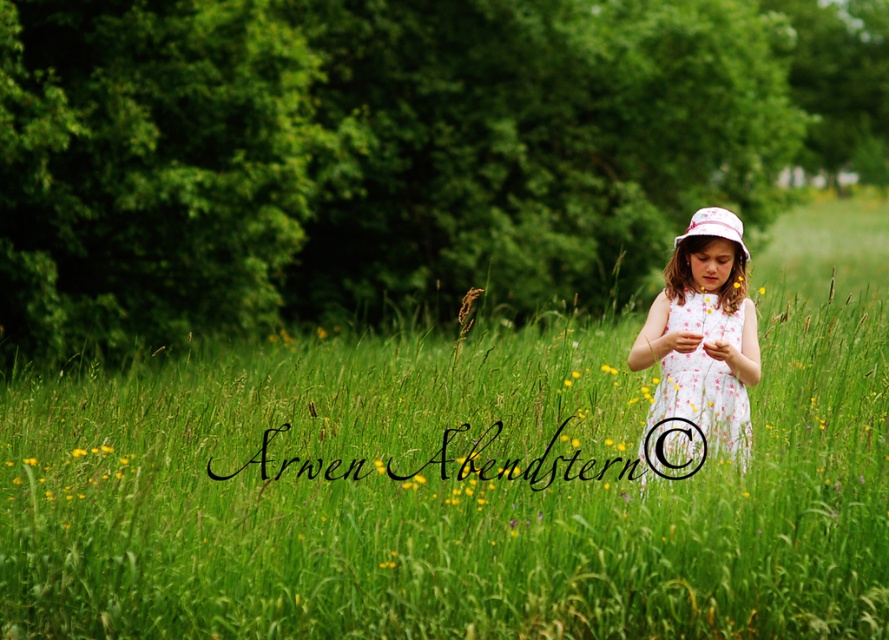
Question: Among these points, which one is nearest to the camera?

Choices:
 (A) (729, 227)
 (B) (755, 320)
 (C) (91, 509)
 (D) (79, 449)

Answer: (C)

Question: Is green grassy field at center below yellow soft grass at center?

Choices:
 (A) no
 (B) yes

Answer: (A)

Question: Which of these objects is positioned closest to the white dotted dress at center?

Choices:
 (A) green grassy field at center
 (B) pink fabric bucket hat at center
 (C) yellow soft grass at center

Answer: (B)

Question: Which of the following is the farthest from the observer?

Choices:
 (A) pink fabric bucket hat at center
 (B) white dotted dress at center

Answer: (A)

Question: Does green grassy field at center have a greater width compared to yellow soft grass at center?

Choices:
 (A) yes
 (B) no

Answer: (A)

Question: Does green grassy field at center have a greater width compared to white dotted dress at center?

Choices:
 (A) yes
 (B) no

Answer: (A)